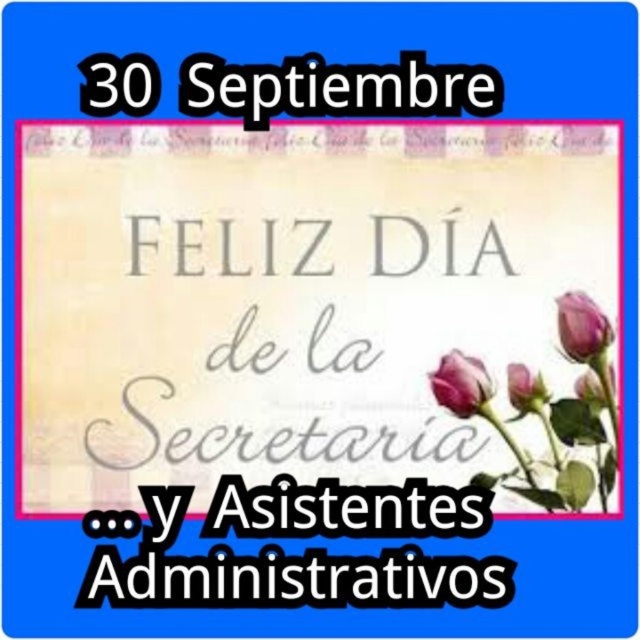
Question: Considering the relative positions of black text at upper center and pink matte rosebud at upper right in the image provided, where is black text at upper center located with respect to pink matte rosebud at upper right?

Choices:
 (A) above
 (B) below

Answer: (A)

Question: Which of the following is the farthest from the observer?

Choices:
 (A) (440, 364)
 (B) (243, 500)

Answer: (A)

Question: Which of the following is the farthest from the observer?

Choices:
 (A) purple matte rosebud at upper right
 (B) purple matte rosebud at center

Answer: (B)

Question: Estimate the real-world distances between objects in this image. Which object is closer to the purple matte rosebud at upper right?

Choices:
 (A) whitematerial/texturetext at lower center
 (B) pink matte rosebud at upper right

Answer: (B)

Question: Observing the image, what is the correct spatial positioning of whitematerial/texturetext at lower center in reference to black text at upper center?

Choices:
 (A) below
 (B) above

Answer: (A)

Question: Is whitematerial/texturetext at lower center bigger than pink matte rosebud at upper right?

Choices:
 (A) no
 (B) yes

Answer: (B)